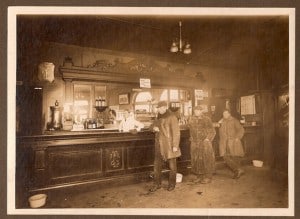
Locate an element on the screen. This screenshot has height=219, width=300. floor is located at coordinates (226, 194).